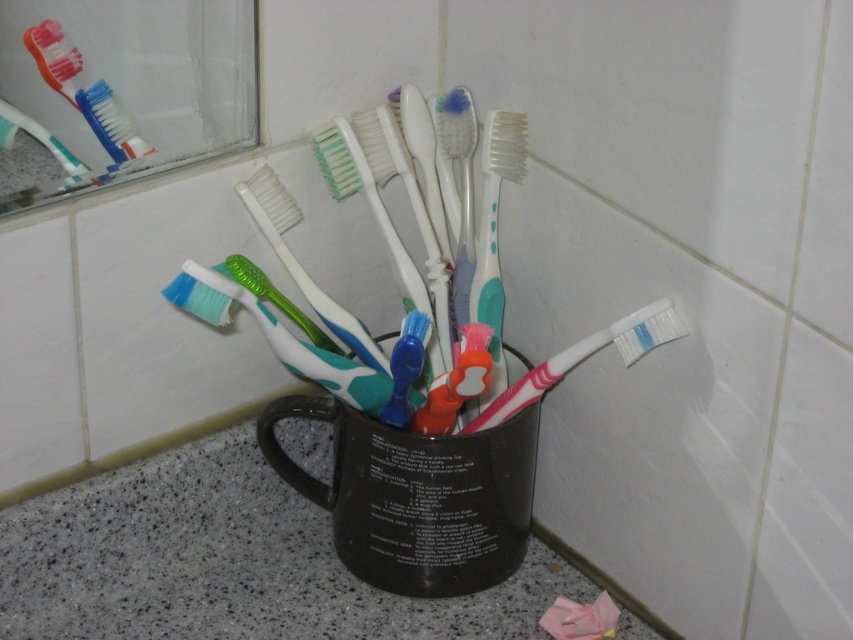
Does black matte mug at center have a smaller size compared to matte plastic toothbrush at upper left?

Incorrect, black matte mug at center is not smaller in size than matte plastic toothbrush at upper left.

The image size is (853, 640). Identify the location of black matte mug at center. (416, 497).

This screenshot has width=853, height=640. I want to click on black matte mug at center, so click(416, 497).

In order to click on black matte mug at center in this screenshot , I will do `click(416, 497)`.

Is granite countertop at lower left wider than green plastic toothbrush at center?

Yes, granite countertop at lower left is wider than green plastic toothbrush at center.

Does point (267, 516) come farther from viewer compared to point (294, 200)?

Yes, it is.

In order to click on granite countertop at lower left in this screenshot , I will do `click(225, 561)`.

The image size is (853, 640). Find the location of `teal plastic toothbrush at center`. teal plastic toothbrush at center is located at coordinates (494, 232).

You are a GUI agent. You are given a task and a screenshot of the screen. Output one action in this format:
    pyautogui.click(x=<x>, y=<y>)
    Task: Click on the teal plastic toothbrush at center
    The width and height of the screenshot is (853, 640).
    Given the screenshot: What is the action you would take?
    (494, 232)